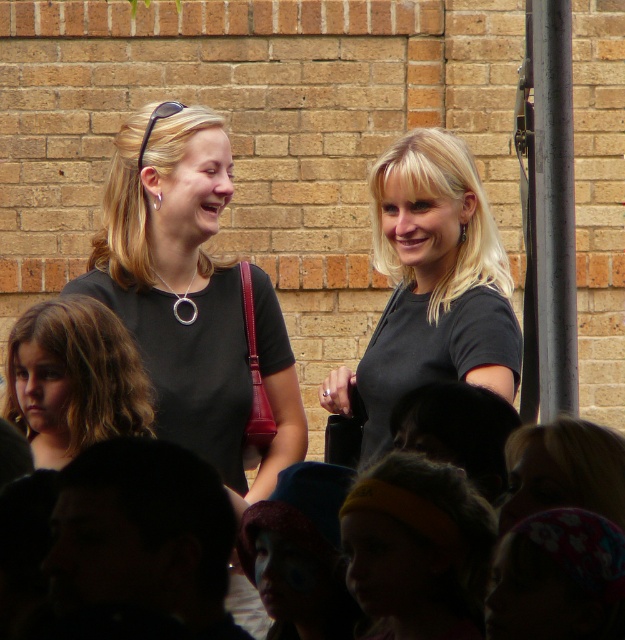
Question: Which point is farther from the camera taking this photo?

Choices:
 (A) (388, 272)
 (B) (28, 429)
 (C) (95, 292)

Answer: (A)

Question: Which point is closer to the camera?

Choices:
 (A) (121, 184)
 (B) (440, 179)

Answer: (B)

Question: Is the position of black matte shirt at center more distant than that of blonde hair at lower left?

Choices:
 (A) yes
 (B) no

Answer: (A)

Question: Which point is farther from the camera taking this photo?

Choices:
 (A) (511, 333)
 (B) (51, 396)

Answer: (A)

Question: Considering the relative positions of metallic pole at right and blonde hair at lower left in the image provided, where is metallic pole at right located with respect to blonde hair at lower left?

Choices:
 (A) above
 (B) below

Answer: (A)

Question: Where is metallic pole at right located in relation to blonde hair at lower left in the image?

Choices:
 (A) left
 (B) right

Answer: (B)